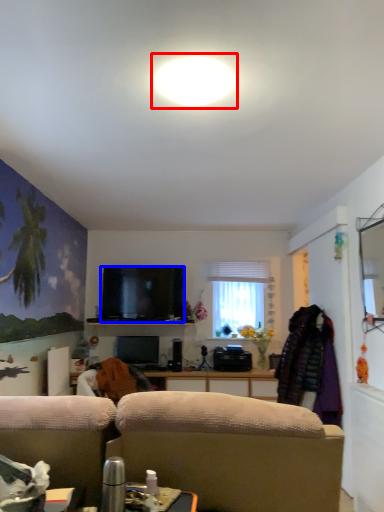
Question: Which point is further to the camera, bright (highlighted by a red box) or television (highlighted by a blue box)?

Choices:
 (A) bright
 (B) television

Answer: (B)